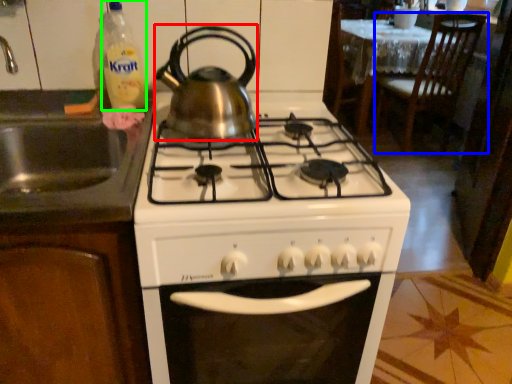
Question: Estimate the real-world distances between objects in this image. Which object is closer to kitchen appliance (highlighted by a red box), chair (highlighted by a blue box) or bottle (highlighted by a green box)?

Choices:
 (A) chair
 (B) bottle

Answer: (B)